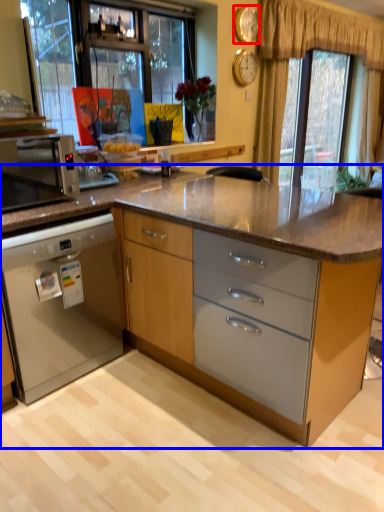
Question: Which object is closer to the camera taking this photo, clock (highlighted by a red box) or cabinetry (highlighted by a blue box)?

Choices:
 (A) clock
 (B) cabinetry

Answer: (B)